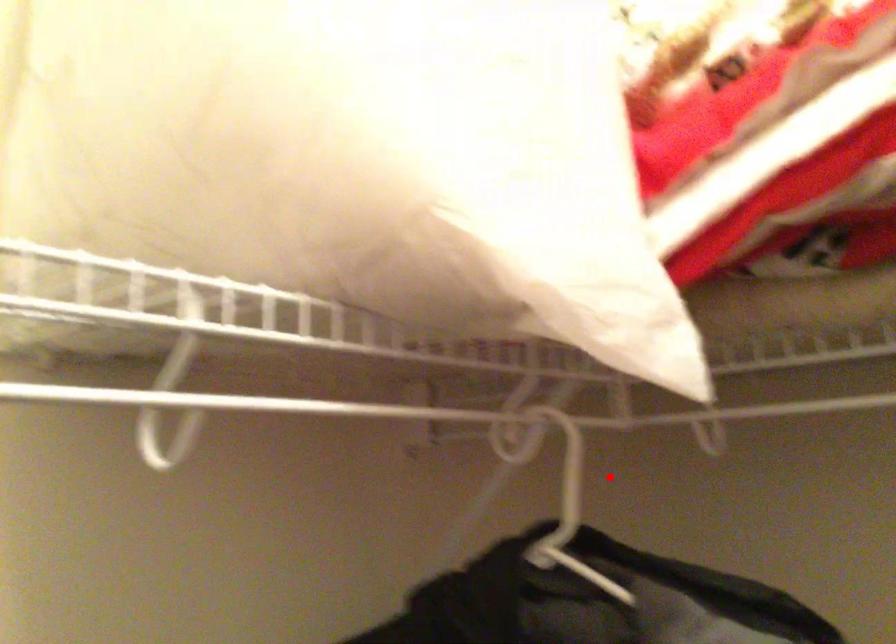
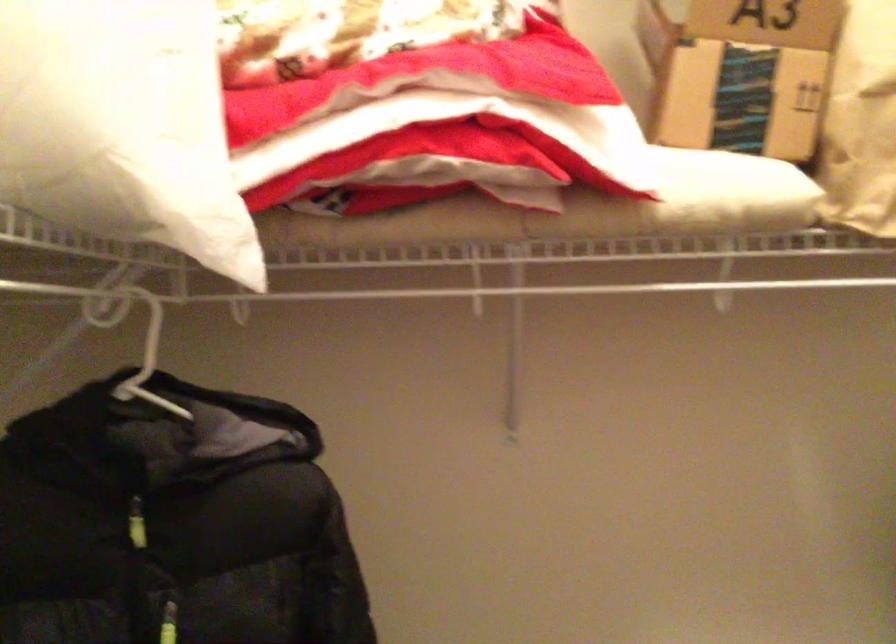
Question: I am providing you with two images of the same scene from different viewpoints. Image1 has a red point marked. In image2, the corresponding 3D location appears at what relative position? Reply with the corresponding letter.

Choices:
 (A) Closer
 (B) Farther

Answer: (B)